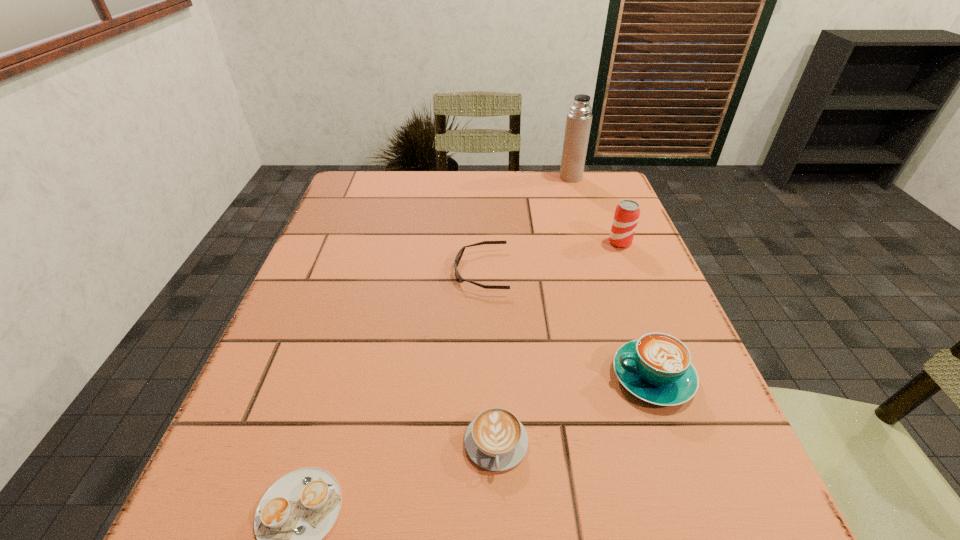
This screenshot has height=540, width=960. I want to click on free space between the second tallest object and the third nearest object, so click(636, 309).

Where is `unoccupied area between the second tallest cappuccino and the tallest cappuccino`? unoccupied area between the second tallest cappuccino and the tallest cappuccino is located at coordinates (574, 410).

I want to click on free space that is in between the fifth shortest object and the second shortest cappuccino, so click(558, 343).

This screenshot has width=960, height=540. I want to click on vacant space that is in between the second tallest object and the second cappuccino from right to left, so click(x=558, y=343).

At what (x,y) coordinates should I click in order to perform the action: click on object identified as the second closest to the beer can. Please return your answer as a coordinate pair (x, y). This screenshot has height=540, width=960. Looking at the image, I should click on (578, 124).

At what (x,y) coordinates should I click in order to perform the action: click on object that is the third closest to the fourth shortest object. Please return your answer as a coordinate pair (x, y). Looking at the image, I should click on (627, 212).

I want to click on cappuccino that can be found as the second closest to the fourth farthest object, so click(294, 515).

Locate which cappuccino ranks third in proximity to the farthest object. Please provide its 2D coordinates. Your answer should be formatted as a tuple, i.e. [(x, y)], where the tuple contains the x and y coordinates of a point satisfying the conditions above.

[(294, 515)]

The height and width of the screenshot is (540, 960). I want to click on vacant space that satisfies the following two spatial constraints: 1. with the handle on the right side of the third nearest object; 2. on the side of the second cappuccino from right to left with the handle, so pos(677,443).

This screenshot has height=540, width=960. In order to click on vacant position in the image that satisfies the following two spatial constraints: 1. on the front side of the fifth shortest object; 2. with the handle on the right side of the tallest cappuccino in this screenshot , I will do `click(674, 377)`.